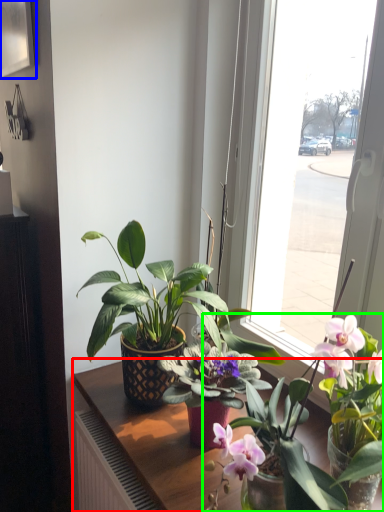
Question: Which is farther away from table (highlighted by a red box)? picture frame (highlighted by a blue box) or houseplant (highlighted by a green box)?

Choices:
 (A) picture frame
 (B) houseplant

Answer: (A)